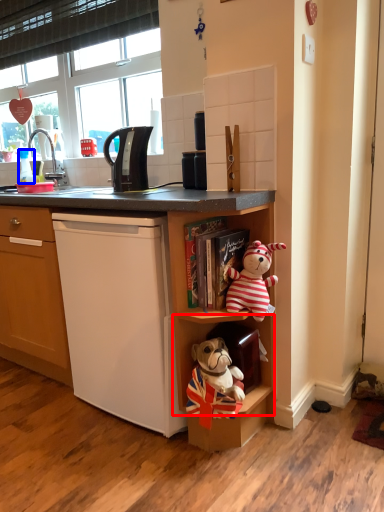
Question: Among these objects, which one is nearest to the camera, cabinet (highlighted by a red box) or coffee cup (highlighted by a blue box)?

Choices:
 (A) cabinet
 (B) coffee cup

Answer: (A)